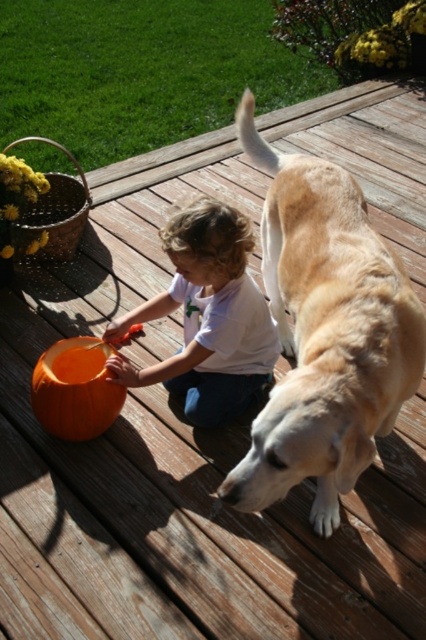
Question: Among these objects, which one is farthest from the camera?

Choices:
 (A) orange matte pumpkin at center
 (B) golden fur dog at center

Answer: (A)

Question: Is golden fur dog at center thinner than white cotton shirt at center?

Choices:
 (A) yes
 (B) no

Answer: (A)

Question: Estimate the real-world distances between objects in this image. Which object is closer to the orange matte pumpkin at center?

Choices:
 (A) golden fur dog at center
 (B) white cotton shirt at center

Answer: (B)

Question: Which is nearer to the orange matte pumpkin at center?

Choices:
 (A) golden fur dog at center
 (B) white cotton shirt at center

Answer: (B)

Question: Is white cotton shirt at center bigger than orange matte pumpkin at center?

Choices:
 (A) yes
 (B) no

Answer: (A)

Question: Can you confirm if golden fur dog at center is thinner than white cotton shirt at center?

Choices:
 (A) no
 (B) yes

Answer: (B)